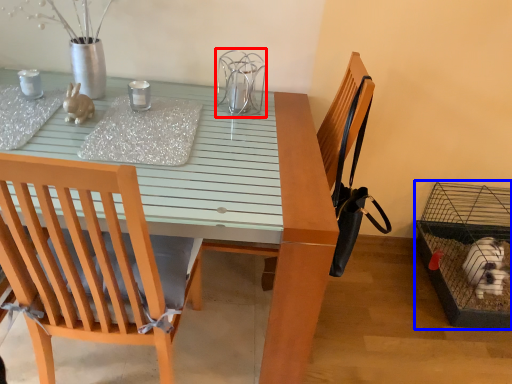
Question: Among these objects, which one is nearest to the camera, bird cage (highlighted by a red box) or bird cage (highlighted by a blue box)?

Choices:
 (A) bird cage
 (B) bird cage

Answer: (A)